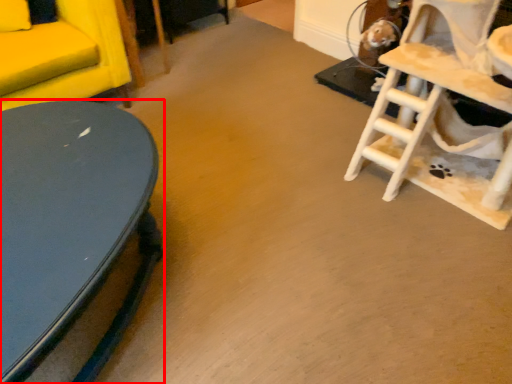
Question: From the image's perspective, what is the correct spatial relationship of table (annotated by the red box) in relation to rocking chair?

Choices:
 (A) above
 (B) below

Answer: (B)